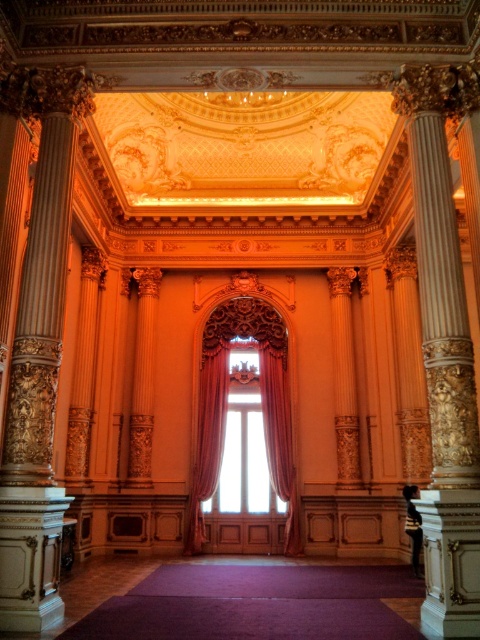
You are standing in the grand room and want to locate the velvet pink curtain at center. According to the coordinates provided, where would you find it?

The velvet pink curtain at center is located at coordinates point (207, 438).

You are an interior designer planning to replace the velvet pink curtain at center and the velvet curtain at center with new ones. Based on their sizes, which curtain should you choose to ensure they match in size?

The velvet pink curtain at center is smaller than the velvet curtain at center, so to ensure they match in size, you should choose the velvet curtain at center as the reference since it is larger.

You are an interior designer planning to install a new chandelier in the center of this grand room. The velvet pink curtain at center and the velvet curtain at center are both in your line of sight. Which curtain should you avoid placing the chandelier directly in front of to ensure it hangs above the center of the room?

The velvet pink curtain at center is taller than the velvet curtain at center, so you should avoid placing the chandelier directly in front of the taller velvet pink curtain at center to ensure it hangs above the center of the room.